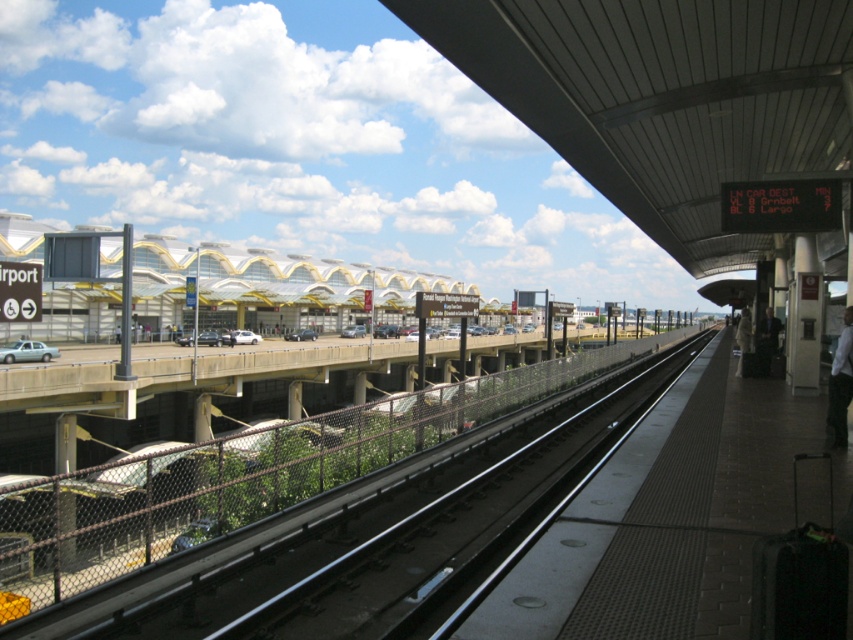
Is white shirt at right positioned in front of white fabric bag at platform right?

Yes, white shirt at right is in front of white fabric bag at platform right.

Who is taller, white shirt at right or white fabric bag at platform right?

white fabric bag at platform right is taller.

Is point (850, 356) positioned in front of point (744, 348)?

Yes, point (850, 356) is closer to viewer.

In order to click on white shirt at right in this screenshot , I will do `click(840, 385)`.

Who is taller, metallic smooth train track at center or white shirt at right?

white shirt at right is taller.

Who is more distant from viewer, (x=341, y=602) or (x=828, y=381)?

The point (x=828, y=381) is behind.

Find the location of a particular element. This screenshot has height=640, width=853. metallic smooth train track at center is located at coordinates (376, 532).

Who is shorter, metallic smooth train track at center or white fabric bag at platform right?

metallic smooth train track at center is shorter.

Is point (337, 534) closer to camera compared to point (740, 317)?

Yes, point (337, 534) is in front of point (740, 317).

Identify the location of metallic smooth train track at center. (376, 532).